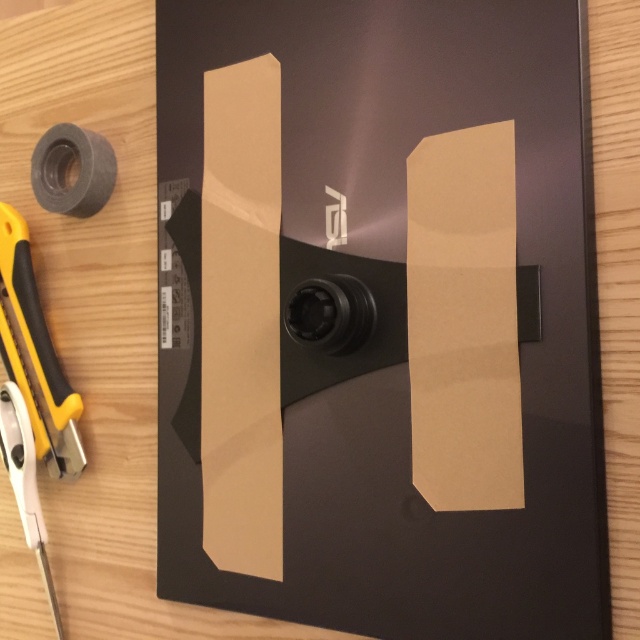
Does brown matte cardboard at center have a smaller size compared to gray matte tape at upper left?

Incorrect, brown matte cardboard at center is not smaller in size than gray matte tape at upper left.

Which is behind, point (352, 148) or point (99, 134)?

Positioned behind is point (99, 134).

Locate an element on the screen. This screenshot has height=640, width=640. brown matte cardboard at center is located at coordinates (396, 317).